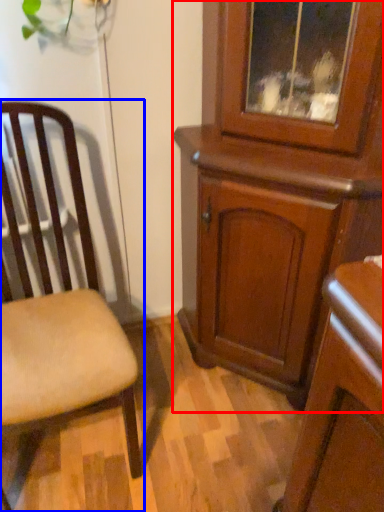
Question: Which object is further to the camera taking this photo, cabinetry (highlighted by a red box) or chair (highlighted by a blue box)?

Choices:
 (A) cabinetry
 (B) chair

Answer: (A)